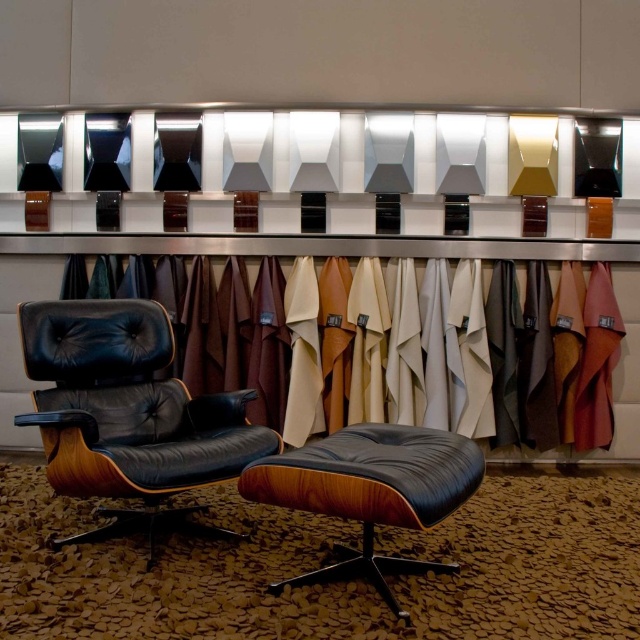
You are standing at the origin point of the coordinate system in the scene. You want to move towards the black leather swivel chair at center. What are the coordinates you need to move to reach it?

The coordinates to reach the black leather swivel chair at center are at point 0.648 on the x axis and 0.202 on the y axis.

You are moving a 5 feet wide sofa into the room. You need to place it between the black leather swivel chair at center and the leather at left. Is there enough space?

The distance between the black leather swivel chair at center and the leather at left is 4.94 feet, which is slightly less than the sofa width of 5 feet. Therefore, there is not enough space to place the sofa between them.

You are an interior designer assessing the layout of this room. You need to determine if the black leather swivel chair at center can fit under a low ceiling without hitting the top. The ceiling height here is exactly the same as the height of the leather at left. Will the chair fit?

The black leather swivel chair at center is not as tall as the leather at left, so it will fit under the ceiling since the ceiling height matches the height of the leather at left.